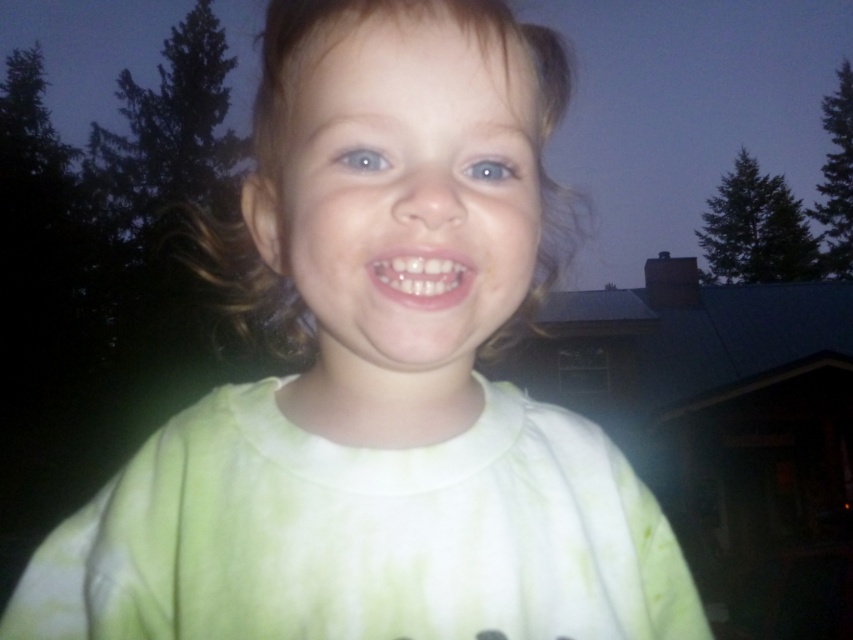
Does light green fabric face at center appear under blue glossy eye at center?

No.

Does point (310, 304) come closer to viewer compared to point (352, 157)?

No.

Is point (524, 202) farther from viewer compared to point (352, 168)?

That is True.

You are a GUI agent. You are given a task and a screenshot of the screen. Output one action in this format:
    pyautogui.click(x=<x>, y=<y>)
    Task: Click on the light green fabric face at center
    The height and width of the screenshot is (640, 853).
    Given the screenshot: What is the action you would take?
    pyautogui.click(x=401, y=172)

Is point (412, 333) farther from camera compared to point (384, 256)?

No, (412, 333) is in front of (384, 256).

Is point (422, 244) closer to camera compared to point (471, 262)?

Yes, it is in front of point (471, 262).

Identify the location of light green fabric face at center. The height and width of the screenshot is (640, 853). (401, 172).

Locate an element on the screen. light green fabric face at center is located at coordinates (401, 172).

Does white glossy teeth at center have a larger size compared to blue glossy eye at center?

Yes.

Is point (421, 296) in front of point (384, 164)?

That is True.

I want to click on white glossy teeth at center, so click(422, 276).

The height and width of the screenshot is (640, 853). Find the location of `white glossy teeth at center`. white glossy teeth at center is located at coordinates (422, 276).